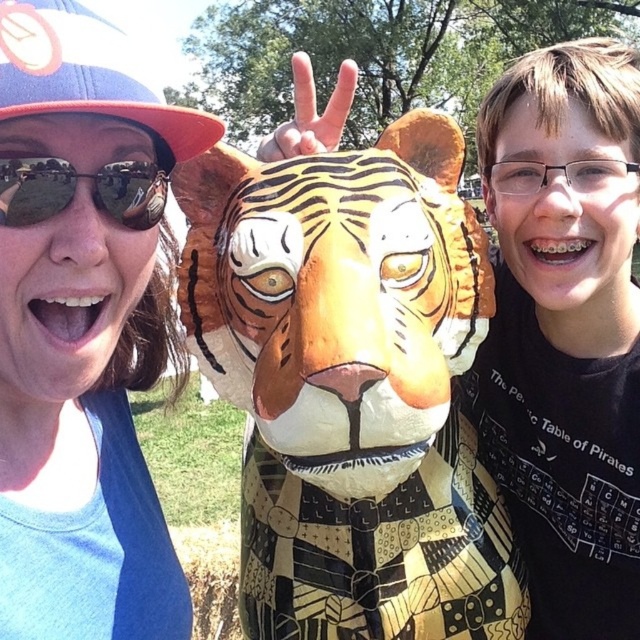
Question: Which object is farther from the camera taking this photo?

Choices:
 (A) matte blue shirt at left
 (B) matte black sunglasses at left
 (C) orange painted mask at center

Answer: (C)

Question: Is orange painted mask at center to the right of matte blue shirt at left from the viewer's perspective?

Choices:
 (A) yes
 (B) no

Answer: (A)

Question: Does orange painted mask at center appear under matte blue shirt at left?

Choices:
 (A) no
 (B) yes

Answer: (B)

Question: Is orange painted mask at center positioned at the back of matte blue shirt at left?

Choices:
 (A) no
 (B) yes

Answer: (B)

Question: Among these points, which one is farthest from the camera?

Choices:
 (A) (440, 166)
 (B) (32, 502)

Answer: (A)

Question: Which point appears closest to the camera in this image?

Choices:
 (A) (33, 202)
 (B) (403, 228)

Answer: (A)